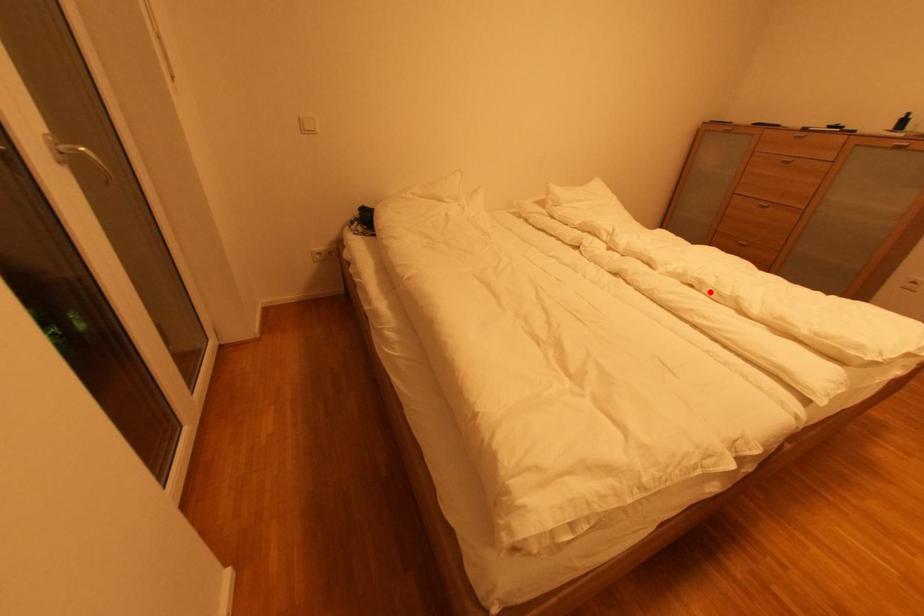
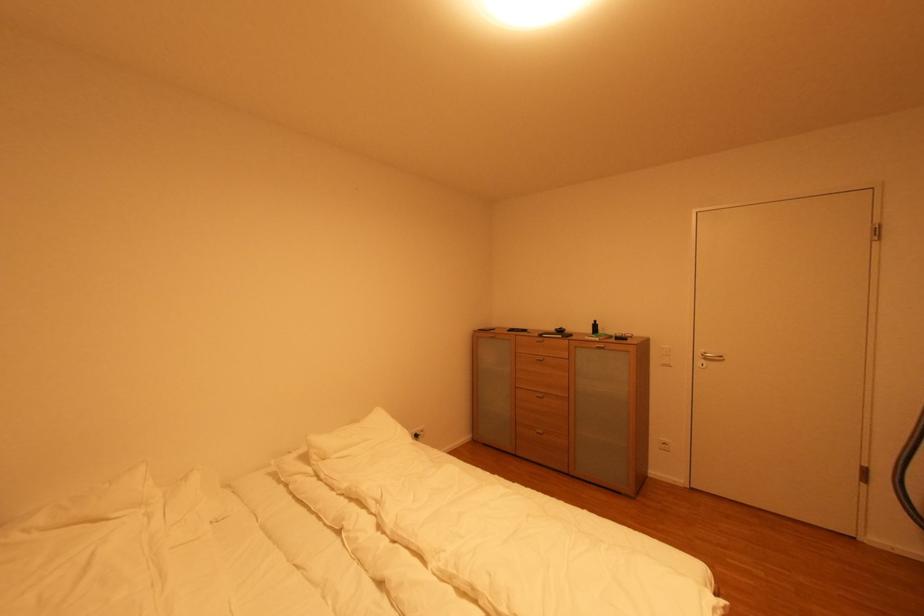
Locate, in the second image, the point that corresponds to the highlighted location in the first image.

(485, 606)